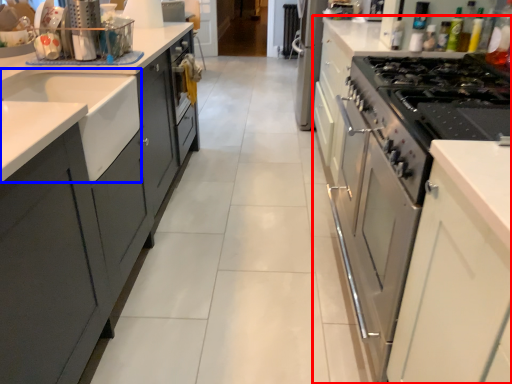
Question: Which point is further to the camera, cabinetry (highlighted by a red box) or sink (highlighted by a blue box)?

Choices:
 (A) cabinetry
 (B) sink

Answer: (B)